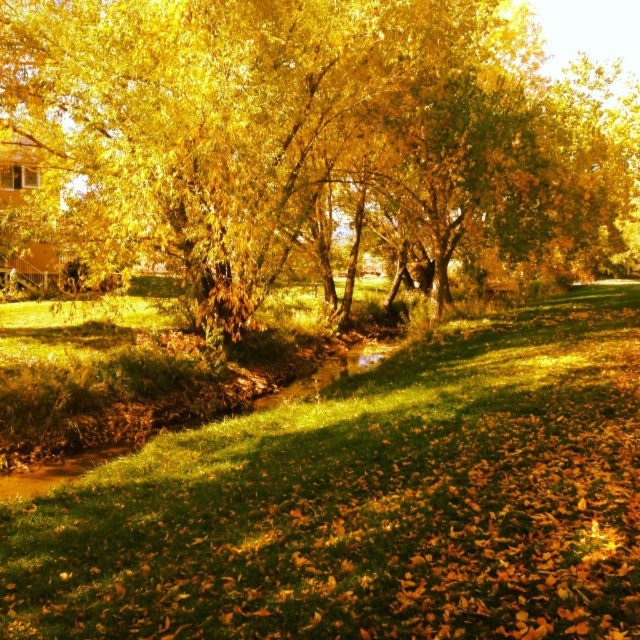
You are standing in the autumn scene and want to place a small decorative stone on the green grass at center. However, you notice the golden leafy tree at center. Where should you place the stone to ensure it stays on the grass?

The golden leafy tree at center is located above green grass at center, so placing the stone on the green grass at center beneath the tree would keep it on the grass.

You are standing in the autumn scene and want to take a photo of both the golden leafy tree at center and the green grass at center. Which object will appear larger in the photo?

The golden leafy tree at center will appear larger in the photo because it is taller than the green grass at center.